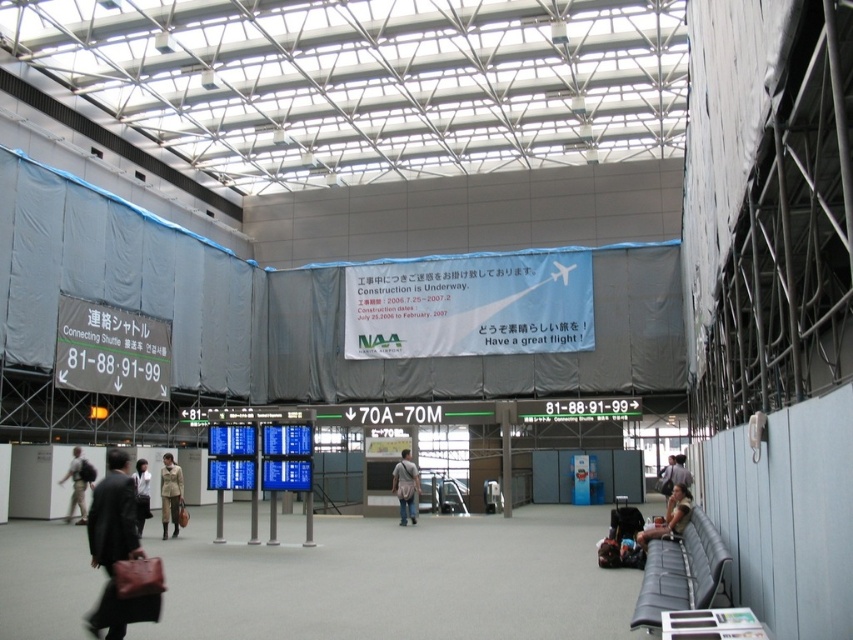
Question: Which object is closer to the camera taking this photo?

Choices:
 (A) khaki fabric jacket at center
 (B) matte black bag at lower right
 (C) khaki pants at center
 (D) leather brown bag at lower left

Answer: (D)

Question: Which of the following is the closest to the observer?

Choices:
 (A) (68, 474)
 (B) (166, 461)
 (C) (111, 621)
 (D) (688, 493)

Answer: (C)

Question: Is the position of matte black bag at lower right less distant than that of light brown leather jacket at lower left?

Choices:
 (A) yes
 (B) no

Answer: (B)

Question: Can you confirm if leather brown bag at lower left is positioned below denim jacket at center?

Choices:
 (A) yes
 (B) no

Answer: (B)

Question: Is denim jacket at center smaller than khaki pants at center?

Choices:
 (A) yes
 (B) no

Answer: (A)

Question: Which of these objects is positioned farthest from the khaki fabric jacket at center?

Choices:
 (A) leather brown bag at lower left
 (B) denim jacket at center

Answer: (B)